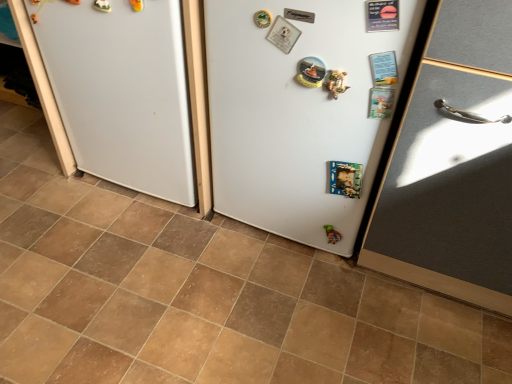
I want to click on free space in front of white matte refrigerator at center, which appears as the first fridge when viewed from the left, so click(125, 263).